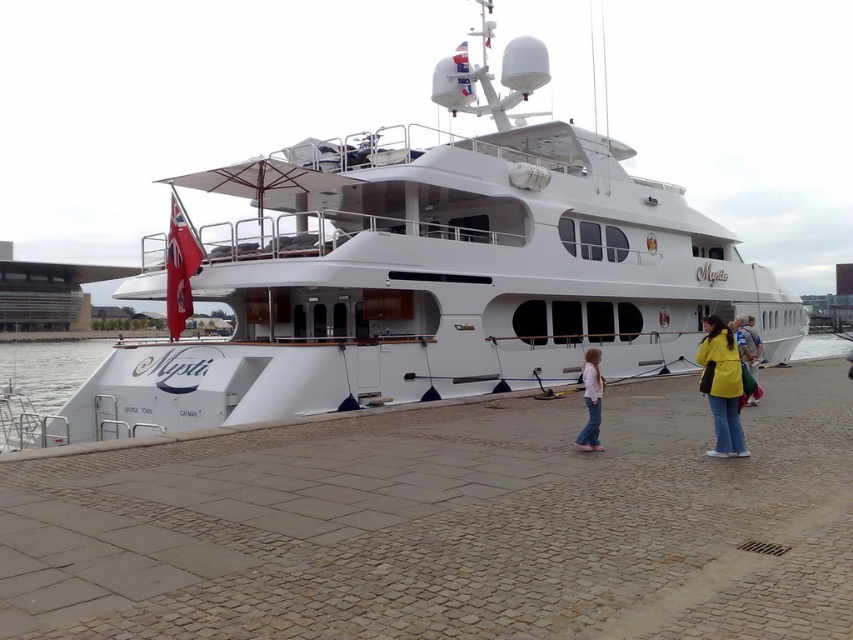
Question: Is white glossy yacht at center wider than pink fabric jacket at lower center?

Choices:
 (A) no
 (B) yes

Answer: (B)

Question: Considering the real-world distances, which object is farthest from the yellow matte jacket at lower right?

Choices:
 (A) pink fabric jacket at lower center
 (B) yellow fabric bag at lower right
 (C) white glossy yacht at center

Answer: (C)

Question: Which point is closer to the camera?

Choices:
 (A) yellow fabric bag at lower right
 (B) pink fabric jacket at lower center

Answer: (A)

Question: Is white glossy yacht at center further to the viewer compared to pink fabric jacket at lower center?

Choices:
 (A) no
 (B) yes

Answer: (B)

Question: Which of the following is the closest to the observer?

Choices:
 (A) yellow matte jacket at lower right
 (B) yellow fabric bag at lower right

Answer: (A)

Question: Considering the relative positions of yellow matte jacket at lower right and pink fabric jacket at lower center in the image provided, where is yellow matte jacket at lower right located with respect to pink fabric jacket at lower center?

Choices:
 (A) left
 (B) right

Answer: (B)